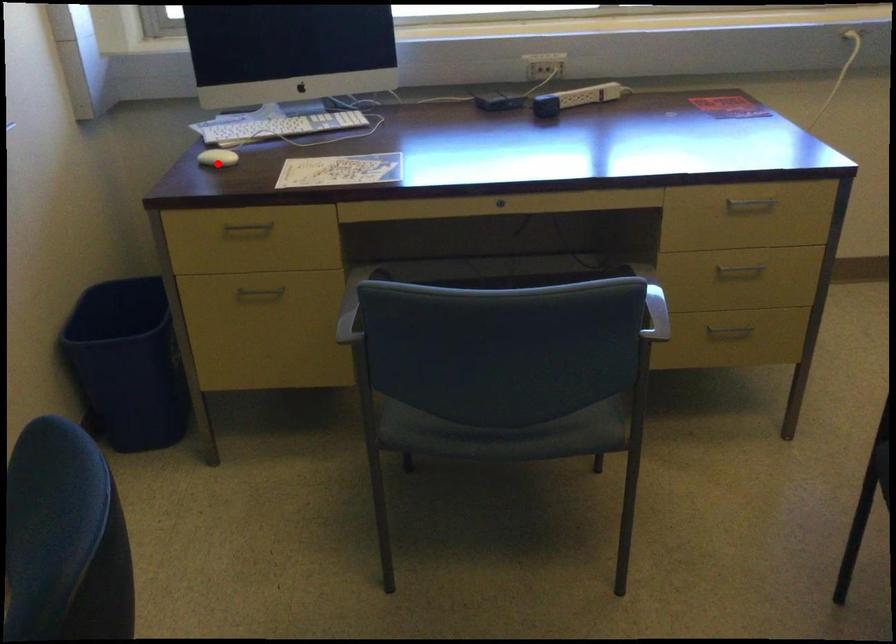
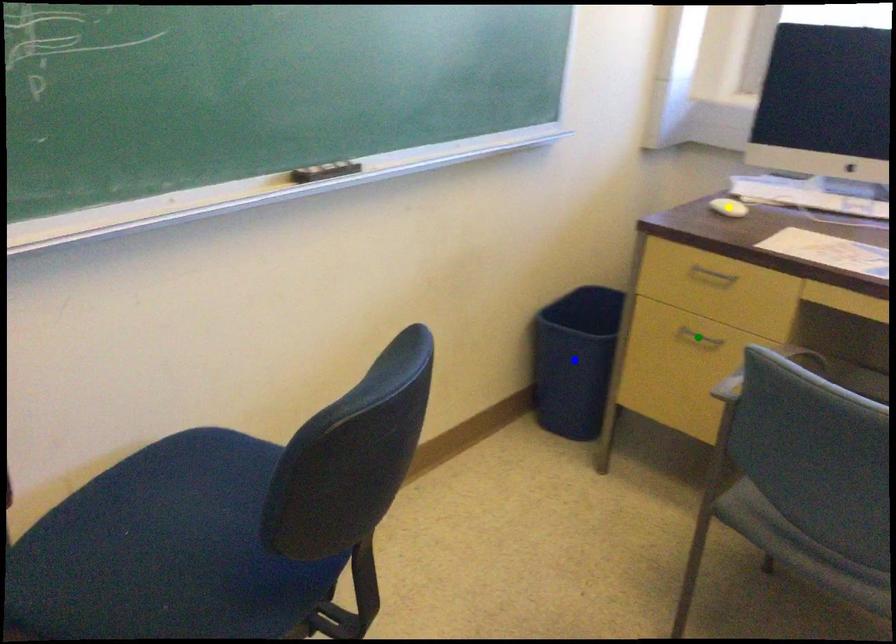
Question: I am providing you with two images of the same scene from different viewpoints. A red point is marked on the first image. You are given multiple points on the second image. Can you choose the point in image 2 that corresponds to the point in image 1?

Choices:
 (A) green point
 (B) blue point
 (C) yellow point

Answer: (C)